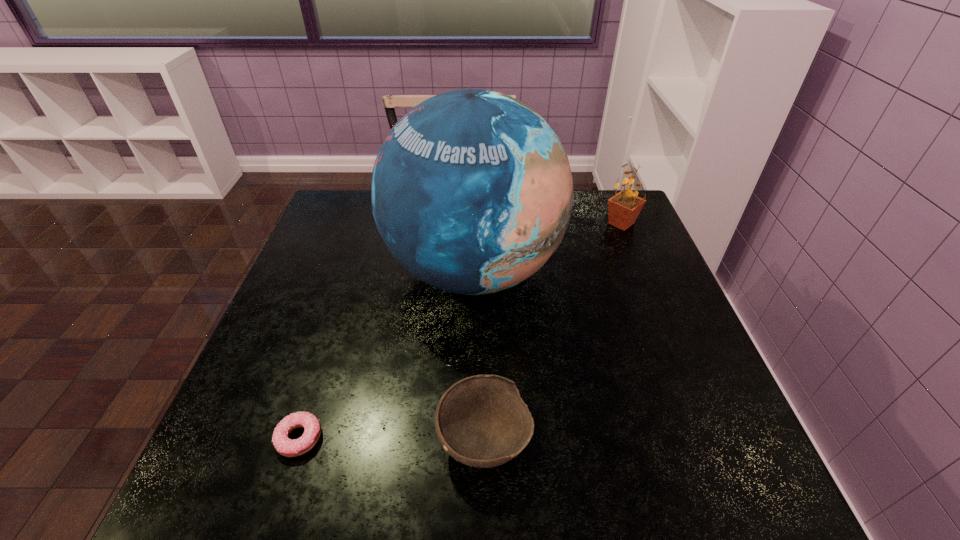
Locate an element on the screen. This screenshot has height=540, width=960. blank region between the leftmost object and the tallest object is located at coordinates (387, 354).

Locate an element on the screen. This screenshot has width=960, height=540. vacant space in between the shortest object and the sunflower is located at coordinates (461, 330).

The image size is (960, 540). Identify the location of vacant space that is in between the shortest object and the bowl. (392, 438).

Locate an element on the screen. object that can be found as the third closest to the globe is located at coordinates (287, 447).

Identify which object is the third closest to the globe. Please provide its 2D coordinates. Your answer should be formatted as a tuple, i.e. [(x, y)], where the tuple contains the x and y coordinates of a point satisfying the conditions above.

[(287, 447)]

You are a GUI agent. You are given a task and a screenshot of the screen. Output one action in this format:
    pyautogui.click(x=<x>, y=<y>)
    Task: Click on the vacant area in the image that satisfies the following two spatial constraints: 1. on the back side of the tallest object; 2. on the left side of the doughnut
    This screenshot has width=960, height=540.
    Given the screenshot: What is the action you would take?
    pyautogui.click(x=353, y=271)